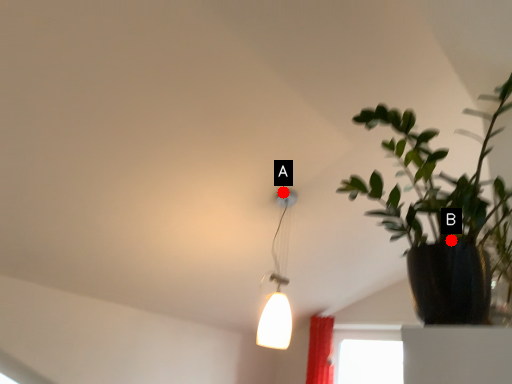
Question: Two points are circled on the image, labeled by A and B beside each circle. Which point is further to the camera?

Choices:
 (A) A is further
 (B) B is further

Answer: (A)